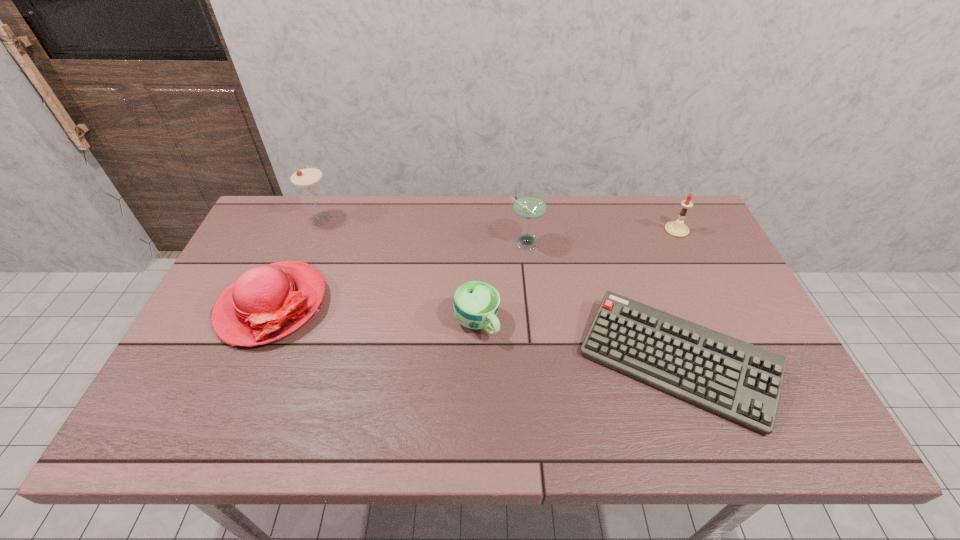
I want to click on the left martini, so click(x=307, y=178).

You are a GUI agent. You are given a task and a screenshot of the screen. Output one action in this format:
    pyautogui.click(x=<x>, y=<y>)
    Task: Click on the third object from right to left
    
    Given the screenshot: What is the action you would take?
    pyautogui.click(x=529, y=205)

What are the coordinates of `the nearer martini` in the screenshot? It's located at (529, 205).

Locate an element on the screen. The height and width of the screenshot is (540, 960). candle is located at coordinates (677, 228).

Locate an element on the screen. The width and height of the screenshot is (960, 540). the third shortest object is located at coordinates (266, 303).

At what (x,y) coordinates should I click in order to perform the action: click on the second shortest object. Please return your answer as a coordinate pair (x, y). The height and width of the screenshot is (540, 960). Looking at the image, I should click on (476, 303).

Locate an element on the screen. The width and height of the screenshot is (960, 540). the fourth object from right to left is located at coordinates click(476, 303).

Find the location of `the shortest object`. the shortest object is located at coordinates (740, 381).

Where is `free spot located on the front of the farther martini`? free spot located on the front of the farther martini is located at coordinates (311, 240).

This screenshot has height=540, width=960. In order to click on vacant region located on the front of the right martini in this screenshot , I will do `click(536, 342)`.